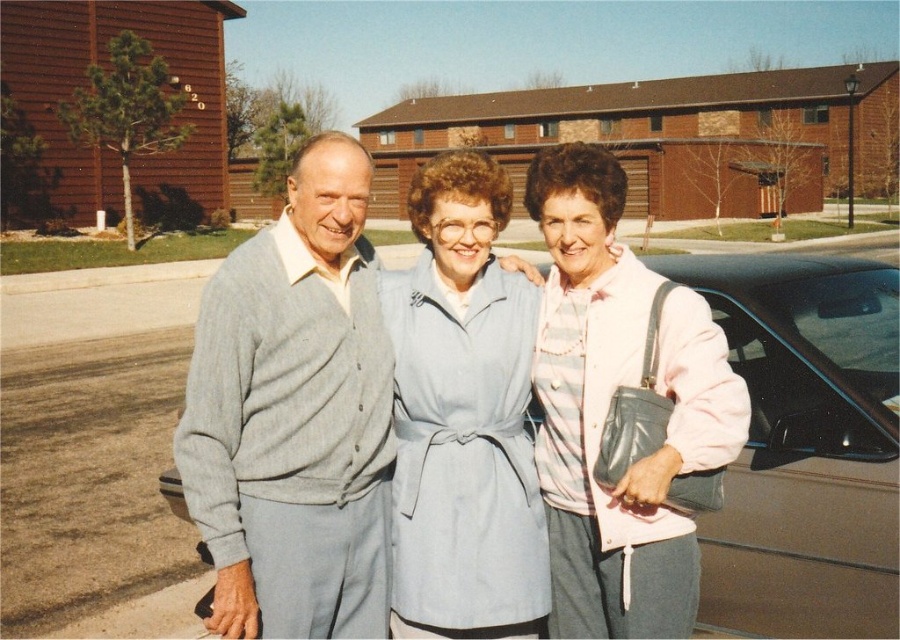
Is metallic gray car at center smaller than light blue fabric coat at center?

No, metallic gray car at center is not smaller than light blue fabric coat at center.

Is point (866, 362) closer to camera compared to point (453, 616)?

No, (866, 362) is behind (453, 616).

I want to click on metallic gray car at center, so click(804, 445).

Who is shorter, gray cardigan at center or light blue fabric coat at center?

Standing shorter between the two is gray cardigan at center.

Between gray cardigan at center and light blue fabric coat at center, which one appears on the left side from the viewer's perspective?

gray cardigan at center

What do you see at coordinates (294, 416) in the screenshot?
I see `gray cardigan at center` at bounding box center [294, 416].

In order to click on gray cardigan at center in this screenshot , I will do `click(294, 416)`.

How distant is gray cardigan at center from pink fabric jacket at center?

gray cardigan at center and pink fabric jacket at center are 30.76 inches apart.

Which is behind, point (294, 260) or point (554, 216)?

Point (294, 260)

At what (x,y) coordinates should I click in order to perform the action: click on gray cardigan at center. Please return your answer as a coordinate pair (x, y). This screenshot has height=640, width=900. Looking at the image, I should click on (294, 416).